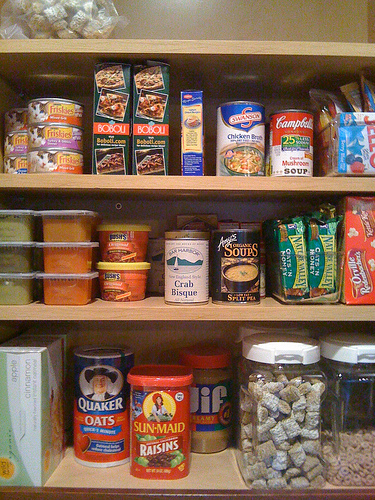
Locate an element on the screen. The height and width of the screenshot is (500, 375). 4 shelves is located at coordinates (93, 15), (87, 93), (85, 248), (86, 408).